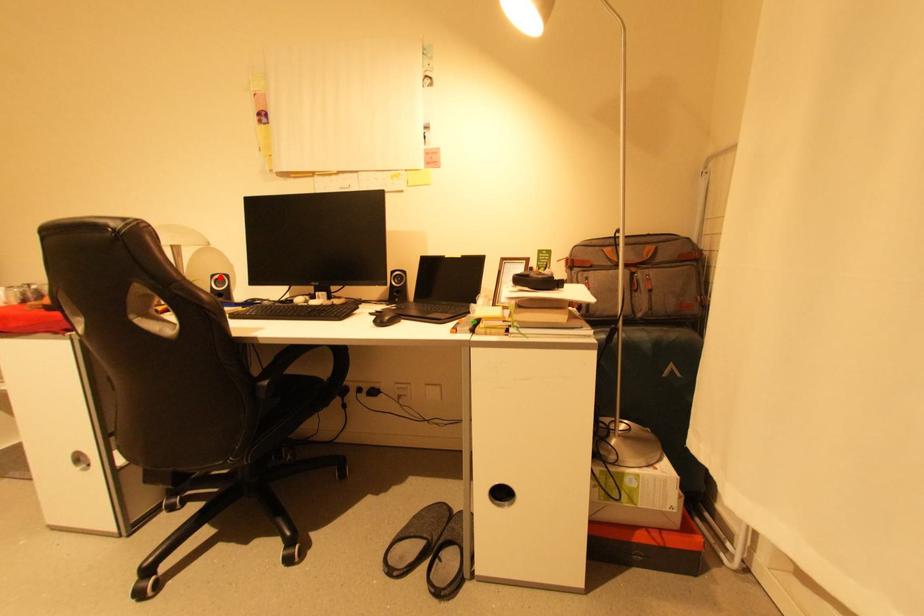
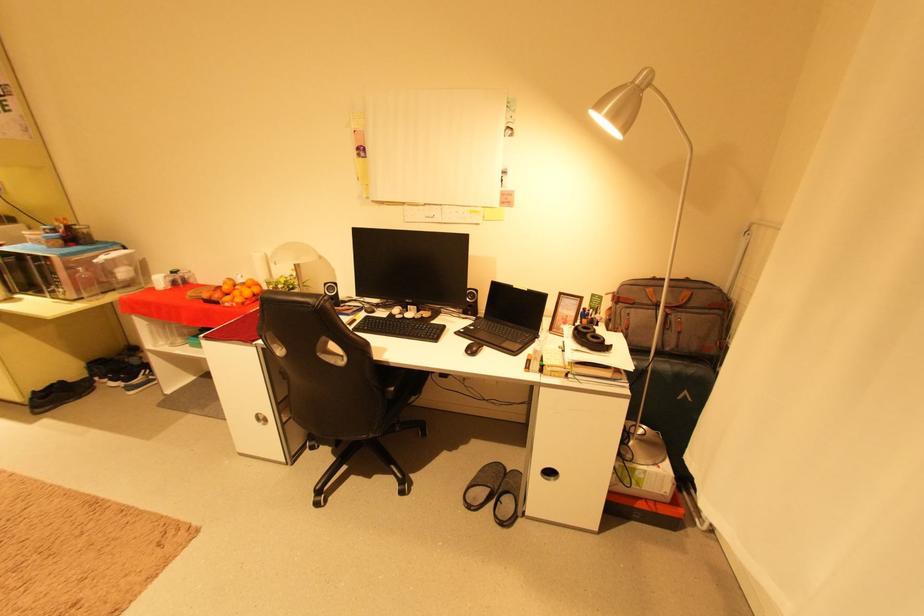
The point at the highlighted location is marked in the first image. Where is the corresponding point in the second image?

(333, 285)